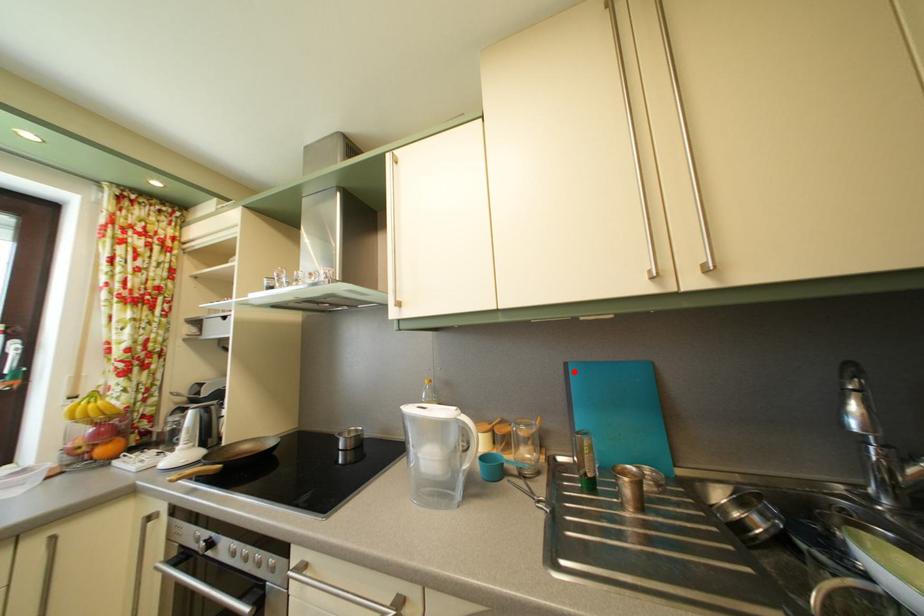
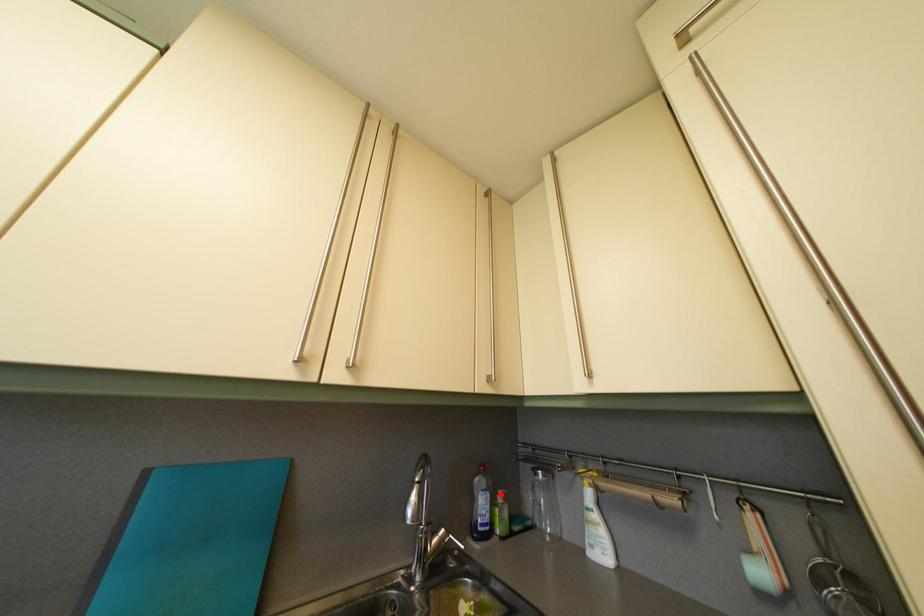
I am providing you with two images of the same scene from different viewpoints. A red point is marked on the first image and another point is marked on the second image. Does the point marked in image1 correspond to the same location as the one in image2?

No